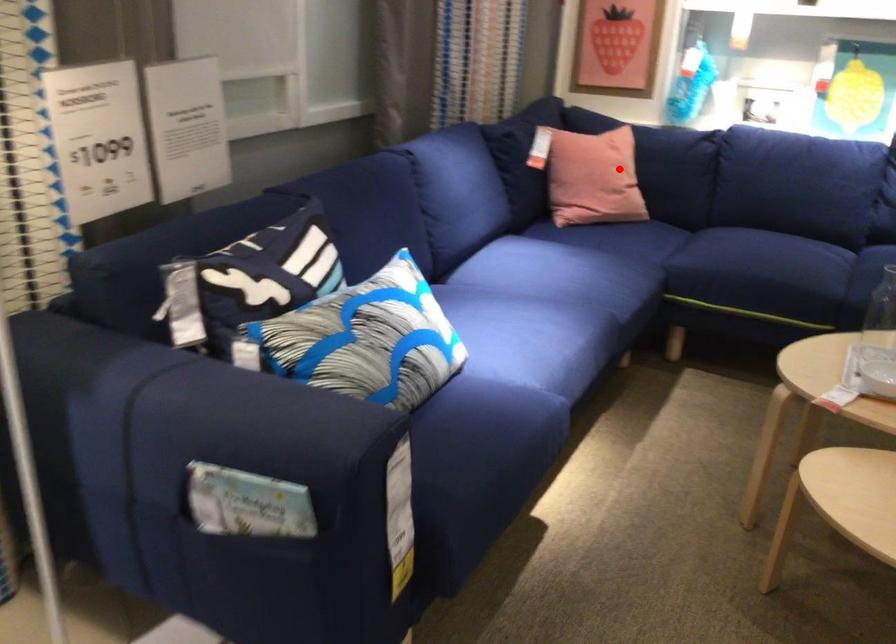
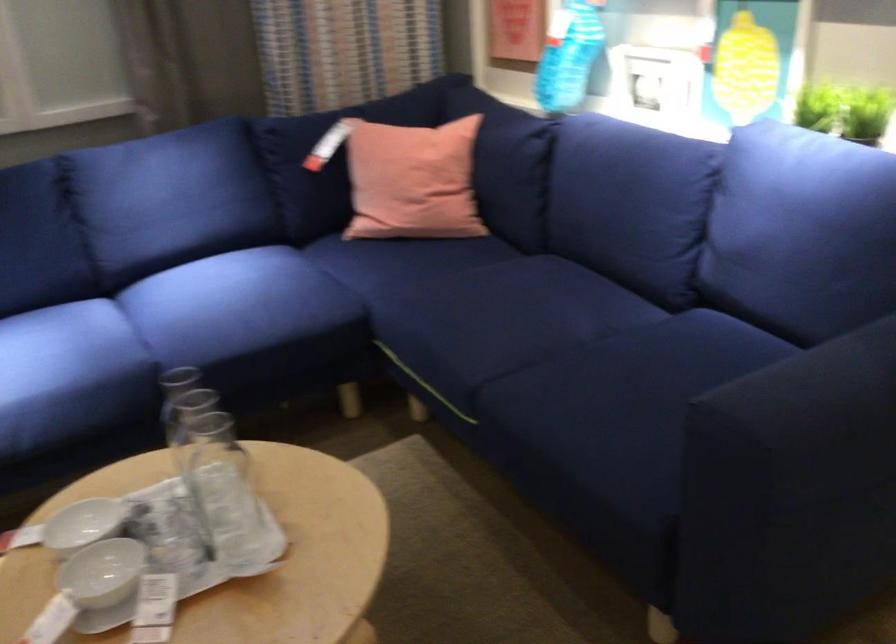
In the second image, find the point that corresponds to the highlighted location in the first image.

(412, 181)